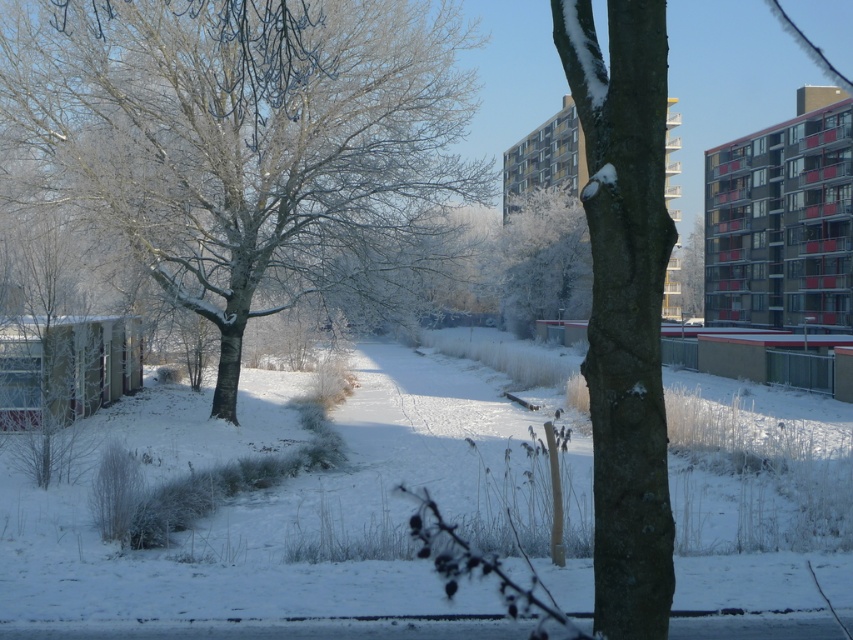
You are an observer standing in the middle of the snowy path. You notice two frosted white trees in the scene. Which one, the frosted white tree at left or the frosted white tree at center, appears bigger to you?

The frosted white tree at left appears bigger because it has a larger size compared to the frosted white tree at center.

You are standing in the winter scene and want to walk towards both the frosted white tree at left and the snowy bark tree at center. Which tree will you reach first?

You will reach the frosted white tree at left first because it is closer to you than the snowy bark tree at center, which is further away.

You are standing in the winter scene and want to walk towards the frosted white tree at center. Which direction should you walk to avoid the frosted white tree at left?

Since the frosted white tree at left is to the left of the frosted white tree at center, you should walk to the right to avoid the frosted white tree at left and head towards the frosted white tree at center.